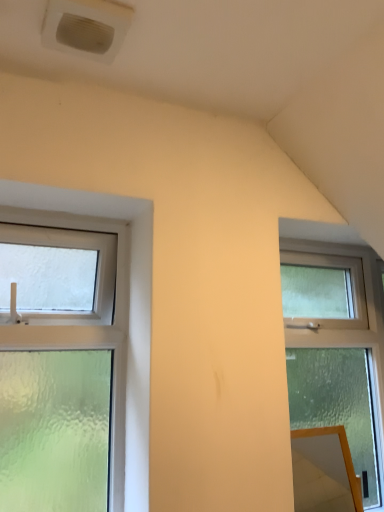
Question: Could you tell me if clear frosted glass window at right, the first window viewed from the right, is turned towards orange glossy mirror at lower right?

Choices:
 (A) yes
 (B) no

Answer: (A)

Question: Does clear frosted glass window at right, the 2th window from the left, have a greater width compared to orange glossy mirror at lower right?

Choices:
 (A) no
 (B) yes

Answer: (B)

Question: Considering the relative positions of clear frosted glass window at right, the 2th window from the left, and orange glossy mirror at lower right in the image provided, is clear frosted glass window at right, the 2th window from the left, to the left of orange glossy mirror at lower right from the viewer's perspective?

Choices:
 (A) yes
 (B) no

Answer: (B)

Question: Is clear frosted glass window at right, the 2th window from the left, positioned in front of orange glossy mirror at lower right?

Choices:
 (A) yes
 (B) no

Answer: (B)

Question: Considering the relative sizes of clear frosted glass window at right, the 2th window from the left, and orange glossy mirror at lower right in the image provided, is clear frosted glass window at right, the 2th window from the left, shorter than orange glossy mirror at lower right?

Choices:
 (A) yes
 (B) no

Answer: (B)

Question: Is point (319, 305) positioned closer to the camera than point (104, 36)?

Choices:
 (A) farther
 (B) closer

Answer: (A)

Question: Looking at their shapes, would you say clear frosted glass window at right, the first window viewed from the right, is wider or thinner than white plastic air conditioning unit at upper left?

Choices:
 (A) wide
 (B) thin

Answer: (B)

Question: From a real-world perspective, is clear frosted glass window at right, the 2th window from the left, physically located above or below white plastic air conditioning unit at upper left?

Choices:
 (A) below
 (B) above

Answer: (A)

Question: In terms of height, does clear frosted glass window at right, the 2th window from the left, look taller or shorter compared to white plastic air conditioning unit at upper left?

Choices:
 (A) short
 (B) tall

Answer: (B)

Question: From a real-world perspective, is clear glass window at left, placed as the second window when sorted from right to left, physically located above or below clear frosted glass window at right, the first window viewed from the right?

Choices:
 (A) below
 (B) above

Answer: (B)

Question: Do you think clear glass window at left, the 1th window viewed from the left, is within clear frosted glass window at right, the 2th window from the left, or outside of it?

Choices:
 (A) inside
 (B) outside

Answer: (B)

Question: Considering the positions of point (61, 346) and point (360, 315), is point (61, 346) closer or farther from the camera than point (360, 315)?

Choices:
 (A) closer
 (B) farther

Answer: (A)

Question: In the image, is clear glass window at left, the 1th window viewed from the left, positioned in front of or behind clear frosted glass window at right, the first window viewed from the right?

Choices:
 (A) front
 (B) behind

Answer: (A)

Question: From their relative heights in the image, would you say orange glossy mirror at lower right is taller or shorter than clear frosted glass window at right, the first window viewed from the right?

Choices:
 (A) tall
 (B) short

Answer: (B)

Question: From a real-world perspective, is orange glossy mirror at lower right positioned above or below clear frosted glass window at right, the first window viewed from the right?

Choices:
 (A) below
 (B) above

Answer: (A)